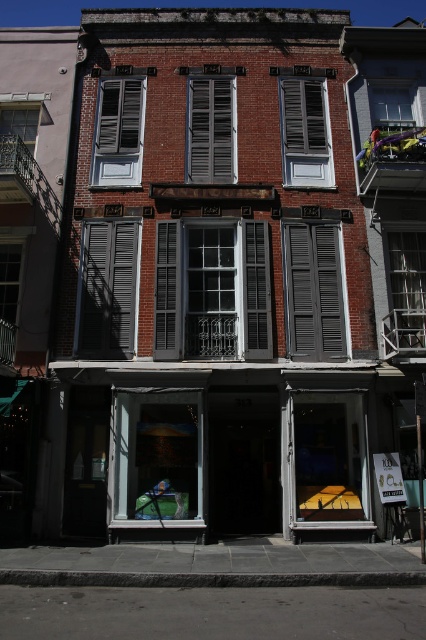
Question: Is brick storefront at center wider than wooden shutters at center?

Choices:
 (A) no
 (B) yes

Answer: (B)

Question: Among these points, which one is farthest from the camera?

Choices:
 (A) (403, 122)
 (B) (31, 113)
 (C) (241, 333)

Answer: (B)

Question: Is matte gray shutters at center above black painted wood shutter at center?

Choices:
 (A) no
 (B) yes

Answer: (B)

Question: Is matte gray shutters at upper left positioned in front of clear glass window at upper right?

Choices:
 (A) no
 (B) yes

Answer: (B)

Question: Which of the following is the farthest from the observer?

Choices:
 (A) (201, 209)
 (B) (423, 259)

Answer: (A)

Question: Estimate the real-world distances between objects in this image. Which object is closer to the gray matte shutter at center?

Choices:
 (A) black painted wood shutter at center
 (B) matte gray shutters at upper left
 (C) clear glass window at center
 (D) clear glass window at upper right

Answer: (A)